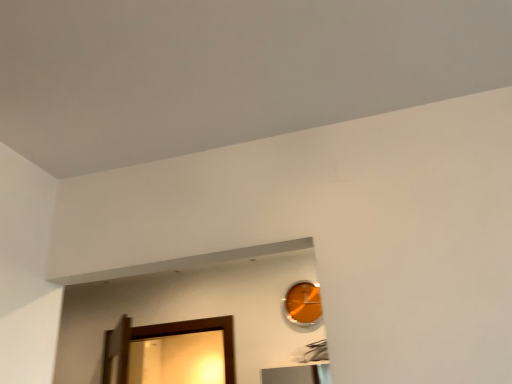
Question: Should I look upward or downward to see orange glass clock at upper center?

Choices:
 (A) up
 (B) down

Answer: (B)